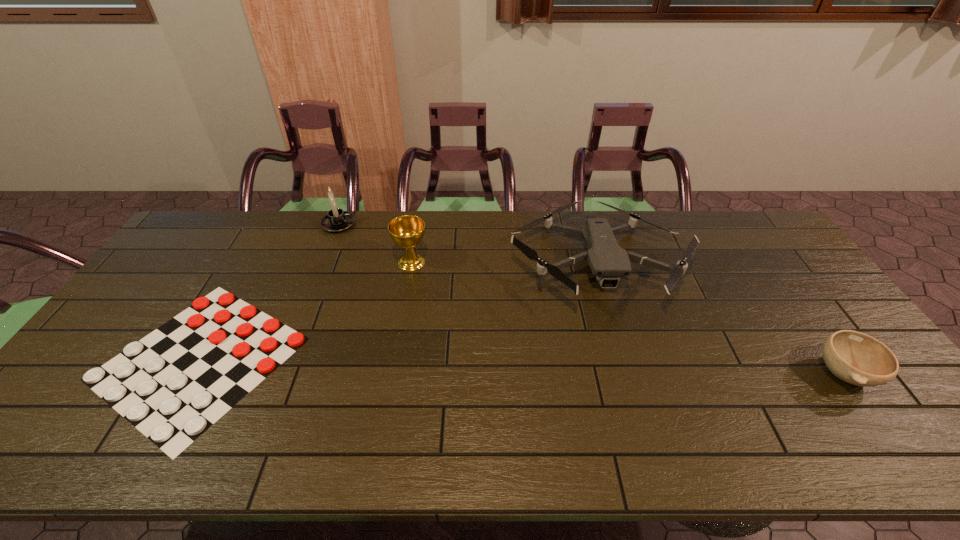
The width and height of the screenshot is (960, 540). Identify the location of candle holder. (336, 220).

The height and width of the screenshot is (540, 960). What are the coordinates of `the third object from left to right` in the screenshot? It's located at (407, 231).

I want to click on the third tallest object, so click(607, 260).

Identify the location of the second object from right to left. The image size is (960, 540). (607, 260).

Find the location of a particular element. This screenshot has height=540, width=960. bowl is located at coordinates (854, 357).

Locate an element on the screen. The height and width of the screenshot is (540, 960). the second shortest object is located at coordinates (854, 357).

This screenshot has height=540, width=960. Find the location of `the shortest object`. the shortest object is located at coordinates (172, 385).

Identify the location of free space located 0.170m with a handle on the side of the candle holder. (402, 225).

In order to click on free space located on the right of the chalice in this screenshot , I will do `click(527, 262)`.

Locate an element on the screen. vacant space situated on the front-facing side of the third tallest object is located at coordinates (644, 421).